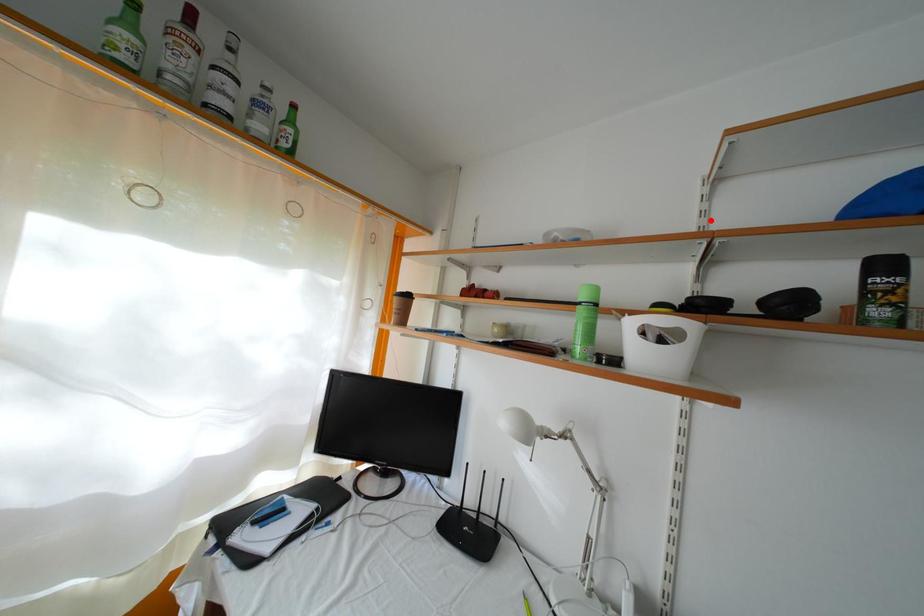
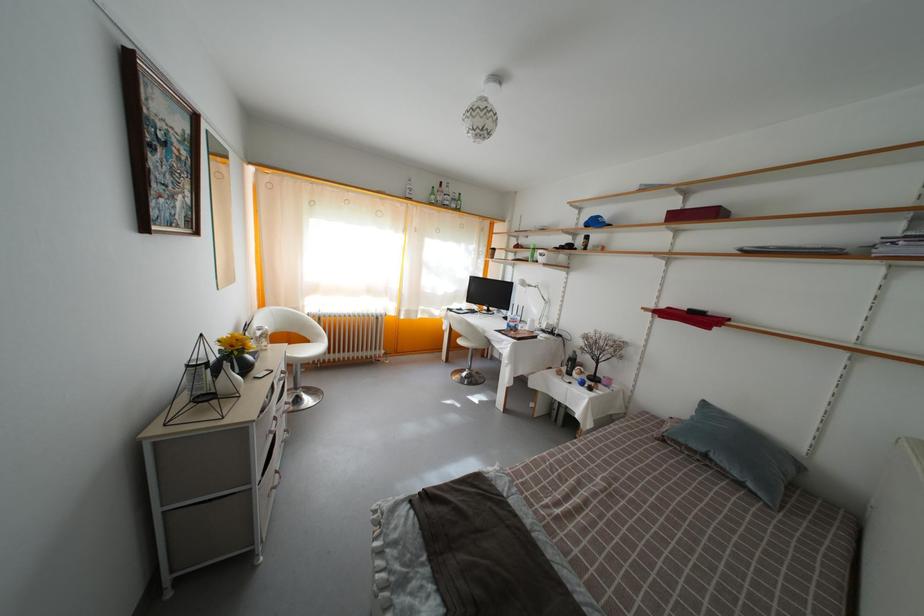
Locate, in the second image, the point that corresponds to the highlighted location in the first image.

(584, 225)